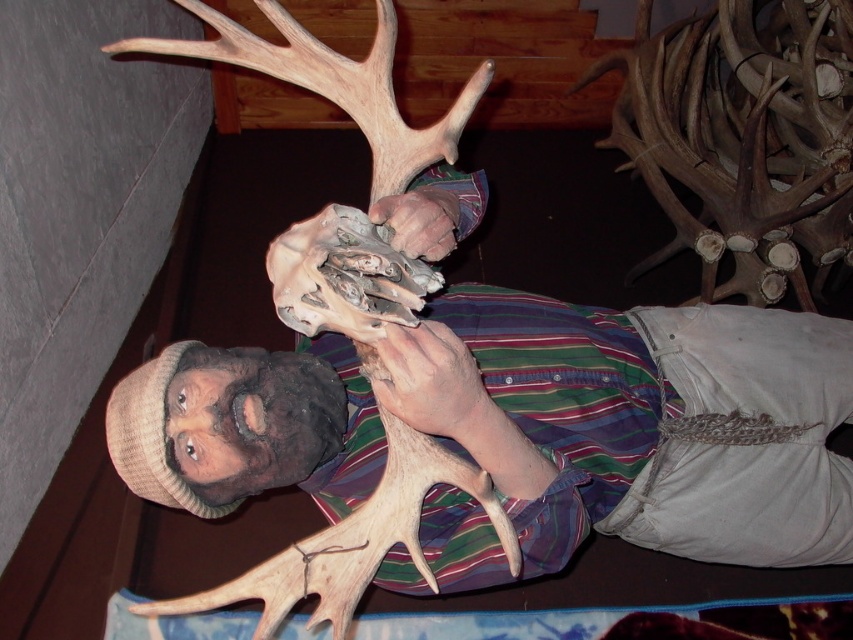
You are a photographer standing 34.27 inches away from the smooth tan skin at center. You want to take a closeup shot of it. Is the distance sufficient for a clear, detailed photo?

The smooth tan skin at center and camera are 34.27 inches apart. This distance is sufficient for a clear, detailed photo as most cameras can focus effectively at this range.

You are an artist creating a sculpture and need to position the smooth tan skin at center and the matte brown hand at center. Based on the scene, which object should be placed higher in your sculpture to maintain the original proportions?

The smooth tan skin at center should be placed higher in the sculpture since it is taller than the matte brown hand at center according to the description.